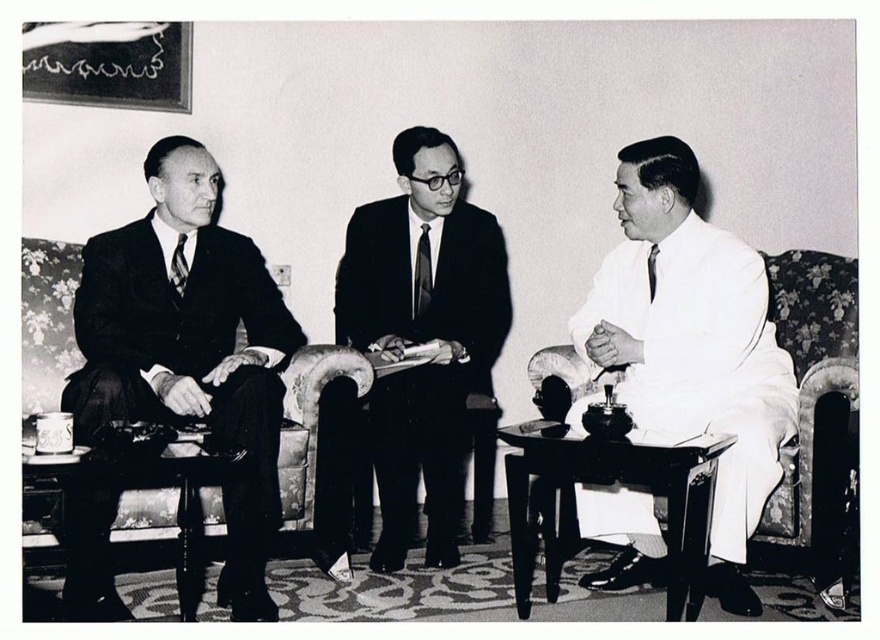
Question: Can you confirm if matte black suit at left is positioned above wooden polished table at lower left?

Choices:
 (A) yes
 (B) no

Answer: (A)

Question: Which of the following is the farthest from the observer?

Choices:
 (A) black silk tie at right
 (B) matte black suit at left

Answer: (A)

Question: Does white silk suit at center appear on the right side of wooden polished table at lower left?

Choices:
 (A) yes
 (B) no

Answer: (A)

Question: Estimate the real-world distances between objects in this image. Which object is closer to the white silk suit at center?

Choices:
 (A) matte black suit at center
 (B) matte black suit at left
 (C) wooden table at center
 (D) black silk tie at right

Answer: (C)

Question: Estimate the real-world distances between objects in this image. Which object is farther from the silky black tie at center?

Choices:
 (A) wooden polished table at lower left
 (B) matte black suit at center
 (C) matte black suit at left
 (D) matte black tie at left

Answer: (A)

Question: Can you confirm if silky black tie at center is bigger than black silk tie at right?

Choices:
 (A) no
 (B) yes

Answer: (B)